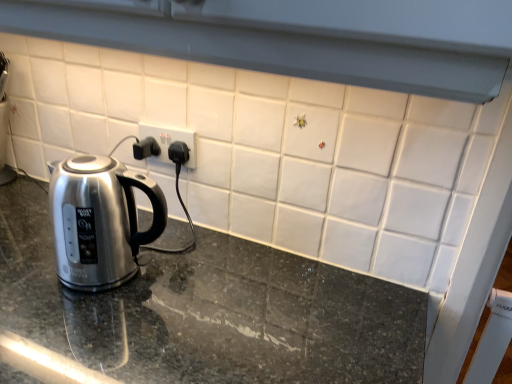
In order to click on white plastic electric outlet at center in this screenshot , I will do (x=169, y=140).

I want to click on satin metallic kettle at left, so click(x=99, y=221).

Image resolution: width=512 pixels, height=384 pixels. Identify the location of granite countertop at center. tap(210, 311).

Is the depth of granite countertop at center less than that of white plastic electric outlet at center?

Yes, granite countertop at center is in front of white plastic electric outlet at center.

Would you consider granite countertop at center to be distant from white plastic electric outlet at center?

granite countertop at center is near white plastic electric outlet at center, not far away.

Measure the distance from granite countertop at center to white plastic electric outlet at center.

granite countertop at center and white plastic electric outlet at center are 14.72 inches apart.

Can you confirm if granite countertop at center is taller than white plastic electric outlet at center?

Yes.

Can you confirm if granite countertop at center is positioned to the right of satin metallic kettle at left?

Indeed, granite countertop at center is positioned on the right side of satin metallic kettle at left.

Do you think granite countertop at center is within satin metallic kettle at left, or outside of it?

granite countertop at center exists outside the volume of satin metallic kettle at left.

Does granite countertop at center have a larger size compared to satin metallic kettle at left?

Yes, granite countertop at center is bigger than satin metallic kettle at left.

Which is in front, point (108, 225) or point (302, 324)?

The point (108, 225) is closer to the camera.

Considering the positions of objects satin metallic kettle at left and granite countertop at center in the image provided, who is more to the right, satin metallic kettle at left or granite countertop at center?

granite countertop at center.

Based on the photo, how many degrees apart are the facing directions of satin metallic kettle at left and granite countertop at center?

0.288 degrees separate the facing orientations of satin metallic kettle at left and granite countertop at center.

Is satin metallic kettle at left aimed at granite countertop at center?

No, satin metallic kettle at left is not turned towards granite countertop at center.

Is white plastic electric outlet at center taller or shorter than granite countertop at center?

white plastic electric outlet at center is shorter than granite countertop at center.

Which of these two, white plastic electric outlet at center or granite countertop at center, is smaller?

Smaller between the two is white plastic electric outlet at center.

Based on the photo, considering the relative positions of white plastic electric outlet at center and granite countertop at center in the image provided, is white plastic electric outlet at center to the right of granite countertop at center from the viewer's perspective?

Incorrect, white plastic electric outlet at center is not on the right side of granite countertop at center.

From a real-world perspective, relative to granite countertop at center, is white plastic electric outlet at center vertically above or below?

In terms of real-world spatial position, white plastic electric outlet at center is above granite countertop at center.

Is point (98, 290) less distant than point (187, 140)?

Yes, it is in front of point (187, 140).

In the scene shown: Who is taller, satin metallic kettle at left or white plastic electric outlet at center?

satin metallic kettle at left.

Considering the relative positions of satin metallic kettle at left and white plastic electric outlet at center in the image provided, is satin metallic kettle at left to the left or to the right of white plastic electric outlet at center?

Based on their positions, satin metallic kettle at left is located to the left of white plastic electric outlet at center.

Is satin metallic kettle at left oriented towards white plastic electric outlet at center?

No.

Considering the relative sizes of white plastic electric outlet at center and satin metallic kettle at left in the image provided, is white plastic electric outlet at center shorter than satin metallic kettle at left?

Yes.

From the image's perspective, is white plastic electric outlet at center located beneath satin metallic kettle at left?

Actually, white plastic electric outlet at center appears above satin metallic kettle at left in the image.

In the scene shown: From a real-world perspective, which is physically below, white plastic electric outlet at center or satin metallic kettle at left?

satin metallic kettle at left.

Considering the relative positions of white plastic electric outlet at center and satin metallic kettle at left in the image provided, is white plastic electric outlet at center to the left or to the right of satin metallic kettle at left?

In the image, white plastic electric outlet at center appears on the right side of satin metallic kettle at left.

Image resolution: width=512 pixels, height=384 pixels. I want to click on electric outlet above the granite countertop at center (from the image's perspective), so click(169, 140).

Locate an element on the screen. table top lying on the right of satin metallic kettle at left is located at coordinates (210, 311).

Based on the photo, looking at the image, which one is located closer to white plastic electric outlet at center, granite countertop at center or satin metallic kettle at left?

satin metallic kettle at left is closer to white plastic electric outlet at center.

When comparing their distances from granite countertop at center, does white plastic electric outlet at center or satin metallic kettle at left seem further?

white plastic electric outlet at center.

Looking at the image, which one is located further to satin metallic kettle at left, white plastic electric outlet at center or granite countertop at center?

white plastic electric outlet at center is positioned further to the anchor satin metallic kettle at left.

Looking at the image, which one is located further to satin metallic kettle at left, granite countertop at center or white plastic electric outlet at center?

Among the two, white plastic electric outlet at center is located further to satin metallic kettle at left.

From the image, which object appears to be nearer to granite countertop at center, satin metallic kettle at left or white plastic electric outlet at center?

A: The object closer to granite countertop at center is satin metallic kettle at left.

Estimate the real-world distances between objects in this image. Which object is closer to white plastic electric outlet at center, satin metallic kettle at left or granite countertop at center?

satin metallic kettle at left lies closer to white plastic electric outlet at center than the other object.

You are a GUI agent. You are given a task and a screenshot of the screen. Output one action in this format:
    pyautogui.click(x=<x>, y=<y>)
    Task: Click on the kettle between white plastic electric outlet at center and granite countertop at center in the vertical direction
    The height and width of the screenshot is (384, 512).
    Given the screenshot: What is the action you would take?
    pyautogui.click(x=99, y=221)